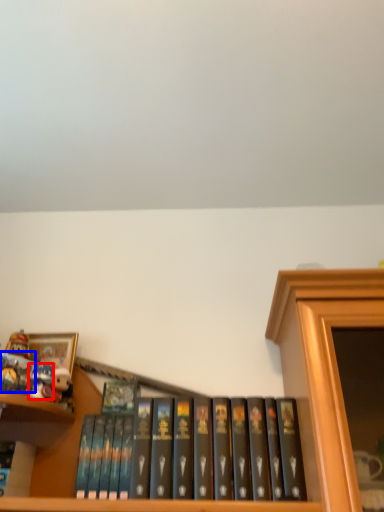
Question: Which of the following is the closest to the observer, toy (highlighted by a red box) or book (highlighted by a blue box)?

Choices:
 (A) toy
 (B) book

Answer: (B)